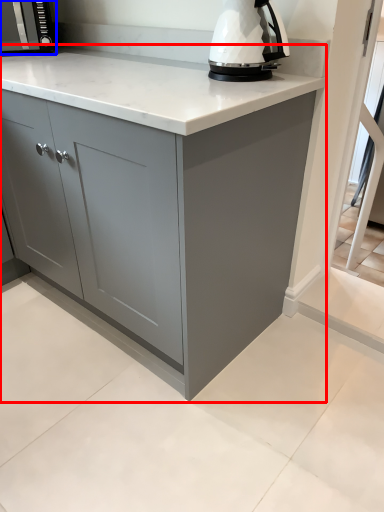
Question: Among these objects, which one is nearest to the camera, cabinetry (highlighted by a red box) or kitchen appliance (highlighted by a blue box)?

Choices:
 (A) cabinetry
 (B) kitchen appliance

Answer: (A)